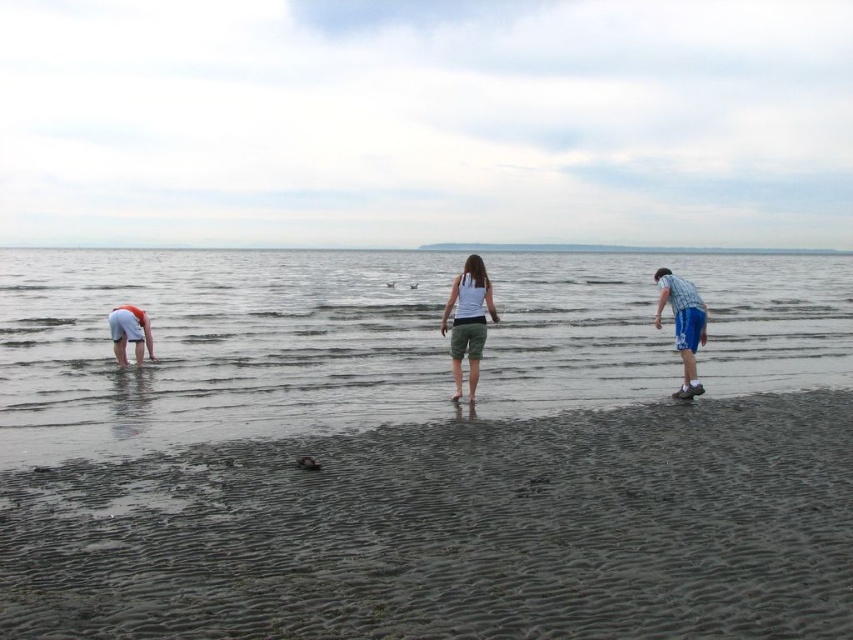
You are a lifeguard on duty at this beach. You notice two objects in the scene labeled as clear water at center and white cotton shirt at center. Which one is located higher in the image?

The clear water at center is above the white cotton shirt at center, so the clear water at center is higher in the image.

You are standing on the beach and want to take a photo of the clear water at center and the white cotton shirt at center. Which object should you focus on first if you want both to be in sharp focus?

The clear water at center is closer to the viewer than the white cotton shirt at center. To ensure both are in focus, focus on the clear water at center first since it is the closer object.

You are standing at point (115, 323) and want to walk to the beach exit located at point (704, 314). Considering the spatial relationship between these two points, will you need to walk towards or away from the shoreline to reach your destination?

Point (704, 314) is in front of point (115, 323), so you will need to walk towards the shoreline to reach the beach exit located at point (704, 314).